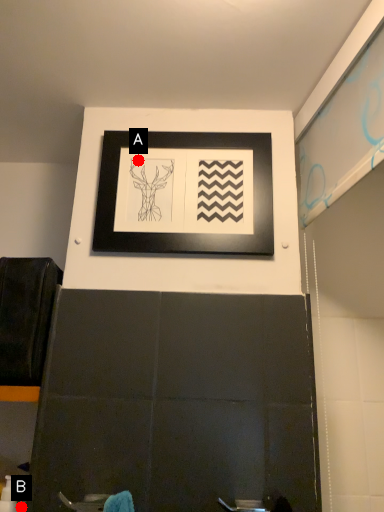
Question: Two points are circled on the image, labeled by A and B beside each circle. Which point is further to the camera?

Choices:
 (A) A is further
 (B) B is further

Answer: (A)